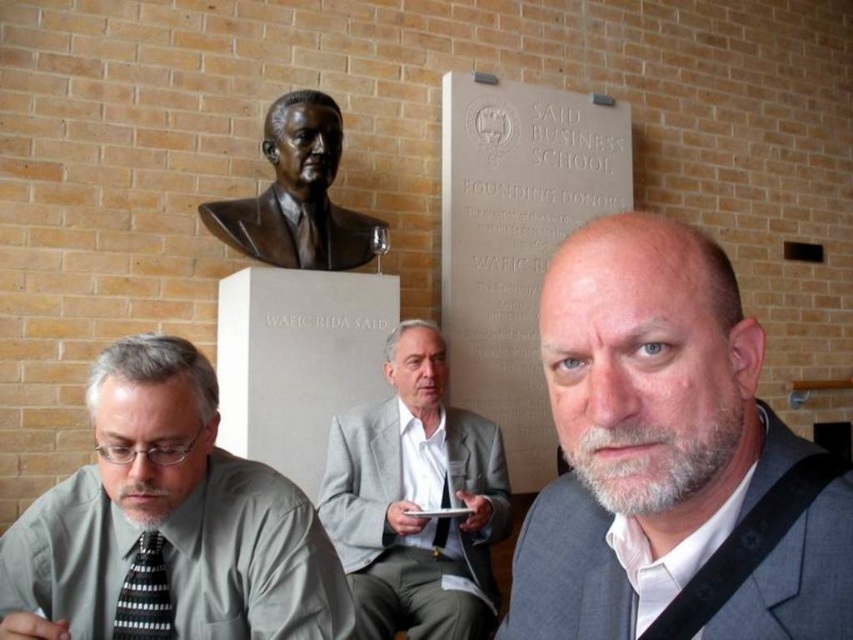
Who is positioned more to the right, gray suit at center or black striped tie at lower left?

Positioned to the right is gray suit at center.

Describe the element at coordinates (671, 460) in the screenshot. I see `gray suit at center` at that location.

The height and width of the screenshot is (640, 853). What do you see at coordinates (671, 460) in the screenshot?
I see `gray suit at center` at bounding box center [671, 460].

Locate an element on the screen. gray suit at center is located at coordinates (671, 460).

Is point (737, 371) closer to viewer compared to point (265, 534)?

Yes, it is.

Does gray suit at center have a larger size compared to gray matte shirt at lower left?

Actually, gray suit at center might be smaller than gray matte shirt at lower left.

In order to click on gray suit at center in this screenshot , I will do `click(671, 460)`.

At what (x,y) coordinates should I click in order to perform the action: click on gray suit at center. Please return your answer as a coordinate pair (x, y). This screenshot has width=853, height=640. Looking at the image, I should click on (671, 460).

Does point (253, 228) come behind point (440, 540)?

That is True.

What do you see at coordinates (297, 195) in the screenshot?
I see `bronze bust at upper center` at bounding box center [297, 195].

Measure the distance between bronze bust at upper center and camera.

2.75 meters

You are a GUI agent. You are given a task and a screenshot of the screen. Output one action in this format:
    pyautogui.click(x=<x>, y=<y>)
    Task: Click on the bronze bust at upper center
    The height and width of the screenshot is (640, 853).
    Given the screenshot: What is the action you would take?
    pyautogui.click(x=297, y=195)